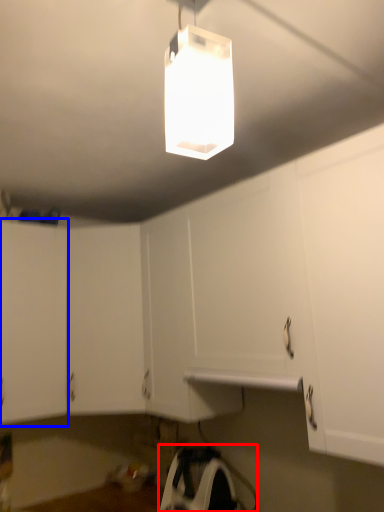
Question: Which object is further to the camera taking this photo, appliance (highlighted by a red box) or cabinetry (highlighted by a blue box)?

Choices:
 (A) appliance
 (B) cabinetry

Answer: (B)